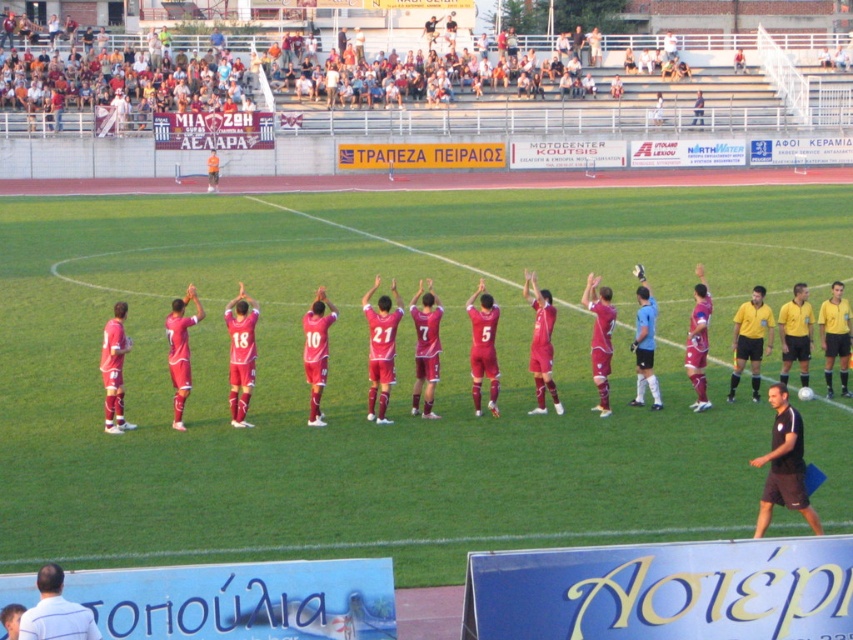
You are a photographer at the soccer field. You need to capture a photo that includes both the black short at lower right and the matte red soccer uniform at center. Which object should you zoom in more on to ensure both are clearly visible in the frame?

The black short at lower right has a lesser height compared to matte red soccer uniform at center, so you should zoom in more on the matte red soccer uniform at center to ensure both are clearly visible in the frame.

Looking at this image, you are a photographer standing at the edge of the soccer field. You want to take a photo that includes both the black short at lower right and the matte red soccer uniform at center. Given that your camera has a maximum focus range of 25 feet, will you be able to capture both subjects in focus without moving your position?

The black short at lower right and matte red soccer uniform at center are 26.62 feet apart from each other. Since the distance exceeds the camera maximum focus range of 25 feet, you will not be able to capture both subjects in focus without moving your position.

You are standing at the center of the soccer field. There is a black short at lower right located at point (784, 465). Can you see the black short at lower right from your current position?

Yes, the black short at lower right is located at point (784, 465), which is within the visible area of the soccer field from the center position.